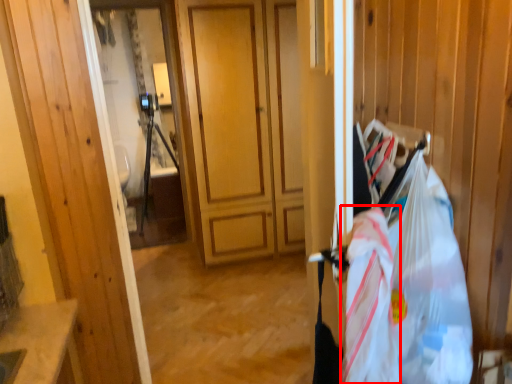
Question: Observing the image, what is the correct spatial positioning of grocery bag (annotated by the red box) in reference to grocery bag?

Choices:
 (A) left
 (B) right

Answer: (A)